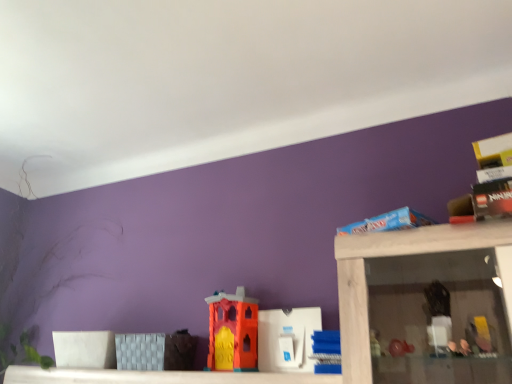
Question: Is white plastic toy at center, which is the second toy in right-to-left order, in front of or behind orange matte plastic castle at center, placed as the first toy when sorted from left to right, in the image?

Choices:
 (A) behind
 (B) front

Answer: (B)

Question: Considering the positions of point (287, 360) and point (234, 365), is point (287, 360) closer or farther from the camera than point (234, 365)?

Choices:
 (A) closer
 (B) farther

Answer: (A)

Question: Which object is the closest to the orange matte plastic castle at center, marked as the 3th toy in a right-to-left arrangement?

Choices:
 (A) white plastic toy at center, which is the second toy in right-to-left order
 (B) blue plastic blocks at center, which is the 3th toy from left to right

Answer: (A)

Question: Which object is positioned closest to the orange matte plastic castle at center, marked as the 3th toy in a right-to-left arrangement?

Choices:
 (A) white plastic toy at center, which is the second toy in left-to-right order
 (B) blue plastic blocks at center, which is the 3th toy from left to right

Answer: (A)